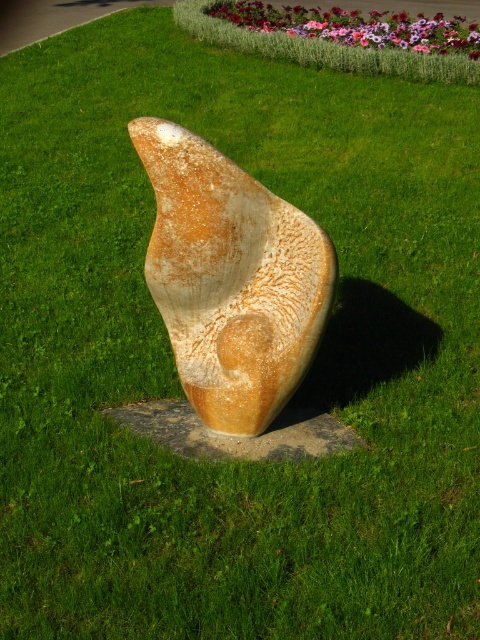
Does rusty stone sculpture at center appear on the left side of pastel floral bed at upper center?

Indeed, rusty stone sculpture at center is positioned on the left side of pastel floral bed at upper center.

Consider the image. Can you confirm if rusty stone sculpture at center is smaller than pastel floral bed at upper center?

Indeed, rusty stone sculpture at center has a smaller size compared to pastel floral bed at upper center.

Describe the element at coordinates (236, 435) in the screenshot. I see `rusty stone sculpture at center` at that location.

Where is `rusty stone sculpture at center`? This screenshot has height=640, width=480. rusty stone sculpture at center is located at coordinates (236, 435).

Does rustic stone sculpture at center have a greater height compared to rusty stone sculpture at center?

Indeed, rustic stone sculpture at center has a greater height compared to rusty stone sculpture at center.

Does rustic stone sculpture at center appear under rusty stone sculpture at center?

Incorrect, rustic stone sculpture at center is not positioned below rusty stone sculpture at center.

Who is more distant from viewer, (x=269, y=266) or (x=201, y=451)?

Positioned behind is point (x=201, y=451).

You are a GUI agent. You are given a task and a screenshot of the screen. Output one action in this format:
    pyautogui.click(x=<x>, y=<y>)
    Task: Click on the rustic stone sculpture at center
    
    Given the screenshot: What is the action you would take?
    pyautogui.click(x=230, y=280)

Is rustic stone sculpture at center thinner than pastel floral bed at upper center?

Yes.

Between point (271, 296) and point (357, 29), which one is positioned behind?

The point (357, 29) is behind.

Does point (162, 259) come farther from viewer compared to point (332, 38)?

No, it is not.

This screenshot has height=640, width=480. Identify the location of rustic stone sculpture at center. (230, 280).